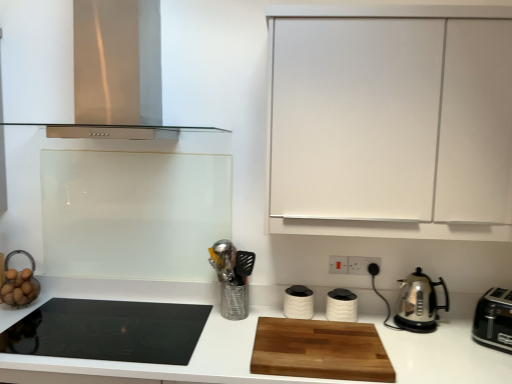
Question: In which direction should I rotate to look at white matte canisters at center, the second kitchen appliance when ordered from left to right?

Choices:
 (A) left
 (B) right

Answer: (B)

Question: Is metallic silver utensil holder at center positioned beyond the bounds of white matte canisters at center, the second kitchen appliance when ordered from left to right?

Choices:
 (A) no
 (B) yes

Answer: (B)

Question: From a real-world perspective, does metallic silver utensil holder at center stand above white matte canisters at center, the second kitchen appliance when ordered from left to right?

Choices:
 (A) yes
 (B) no

Answer: (A)

Question: Is metallic silver utensil holder at center shorter than white matte canisters at center, the second kitchen appliance when ordered from left to right?

Choices:
 (A) yes
 (B) no

Answer: (B)

Question: Considering the relative sizes of metallic silver utensil holder at center and white matte canisters at center, the second kitchen appliance when ordered from left to right, in the image provided, is metallic silver utensil holder at center bigger than white matte canisters at center, the second kitchen appliance when ordered from left to right,?

Choices:
 (A) no
 (B) yes

Answer: (B)

Question: From the image's perspective, would you say metallic silver utensil holder at center is shown under white matte canisters at center, the third kitchen appliance from the right?

Choices:
 (A) no
 (B) yes

Answer: (A)

Question: Does metallic silver utensil holder at center lie in front of white matte canisters at center, the second kitchen appliance when ordered from left to right?

Choices:
 (A) yes
 (B) no

Answer: (A)

Question: Considering the relative sizes of black plastic toaster at right, the first kitchen appliance viewed from the right, and white plastic electric outlet at center-right, acting as the third electric outlet starting from the right, in the image provided, is black plastic toaster at right, the first kitchen appliance viewed from the right, shorter than white plastic electric outlet at center-right, acting as the third electric outlet starting from the right,?

Choices:
 (A) yes
 (B) no

Answer: (B)

Question: Is black plastic toaster at right, positioned as the fourth kitchen appliance in left-to-right order, taller than white plastic electric outlet at center-right, acting as the first electric outlet starting from the left?

Choices:
 (A) yes
 (B) no

Answer: (A)

Question: Is black plastic toaster at right, the first kitchen appliance viewed from the right, oriented towards white plastic electric outlet at center-right, acting as the third electric outlet starting from the right?

Choices:
 (A) yes
 (B) no

Answer: (B)

Question: Is white plastic electric outlet at center-right, acting as the third electric outlet starting from the right, inside black plastic toaster at right, the first kitchen appliance viewed from the right?

Choices:
 (A) yes
 (B) no

Answer: (B)

Question: Can you confirm if black plastic toaster at right, the first kitchen appliance viewed from the right, is positioned to the right of white plastic electric outlet at center-right, acting as the first electric outlet starting from the left?

Choices:
 (A) no
 (B) yes

Answer: (B)

Question: Does black plastic toaster at right, the first kitchen appliance viewed from the right, have a smaller size compared to white plastic electric outlet at center-right, acting as the third electric outlet starting from the right?

Choices:
 (A) yes
 (B) no

Answer: (B)

Question: Is polished stainless steel kettle at right, positioned as the second kitchen appliance in right-to-left order, bigger than wooden cutting board at center?

Choices:
 (A) yes
 (B) no

Answer: (B)